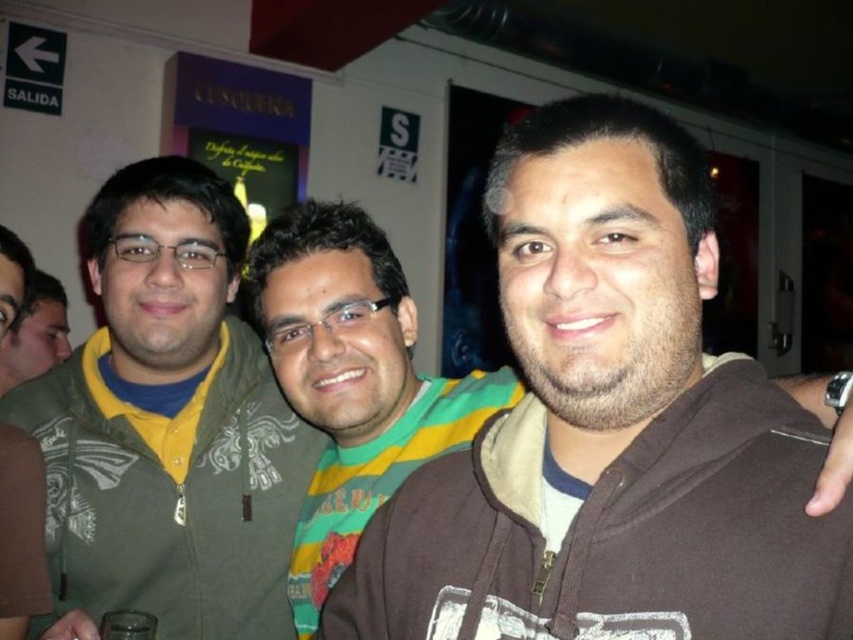
Identify the location of green textured hoodie at left. (167, 424).

The image size is (853, 640). What do you see at coordinates (167, 424) in the screenshot? I see `green textured hoodie at left` at bounding box center [167, 424].

I want to click on green textured hoodie at left, so click(167, 424).

In order to click on green textured hoodie at left in this screenshot , I will do `click(167, 424)`.